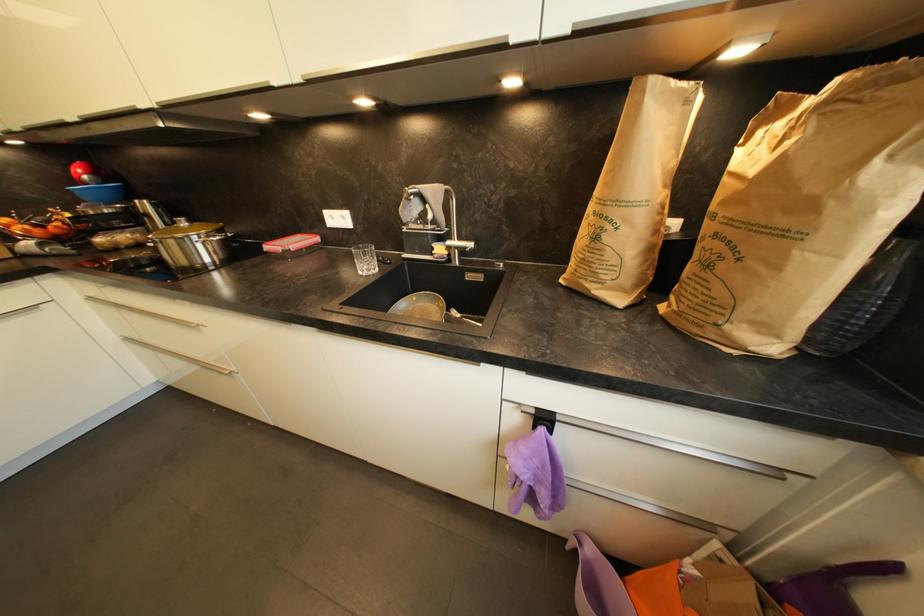
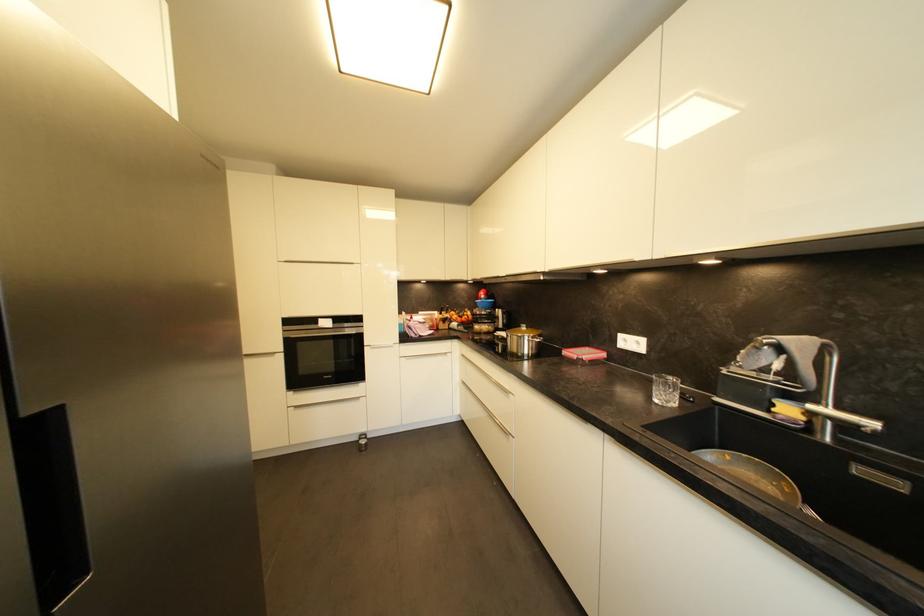
Find the pixel in the second image that matches [444,252] in the first image.

(793, 411)